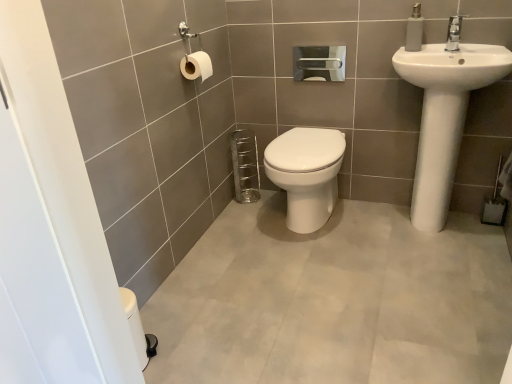
Question: Is white glossy toilet at center positioned beyond the bounds of white matte soap dispenser at upper right?

Choices:
 (A) yes
 (B) no

Answer: (A)

Question: Can you confirm if white glossy toilet at center is bigger than white matte soap dispenser at upper right?

Choices:
 (A) yes
 (B) no

Answer: (A)

Question: From the image's perspective, would you say white glossy toilet at center is positioned over white matte soap dispenser at upper right?

Choices:
 (A) yes
 (B) no

Answer: (B)

Question: Does white glossy toilet at center appear on the left side of white matte soap dispenser at upper right?

Choices:
 (A) yes
 (B) no

Answer: (A)

Question: Is white glossy toilet at center next to white matte soap dispenser at upper right?

Choices:
 (A) no
 (B) yes

Answer: (A)

Question: From a real-world perspective, is white glossy toilet at center physically above white matte soap dispenser at upper right?

Choices:
 (A) no
 (B) yes

Answer: (A)

Question: Could you tell me if white glossy toilet at center is turned towards white glossy toilet at center?

Choices:
 (A) no
 (B) yes

Answer: (B)

Question: Can you confirm if white glossy toilet at center is taller than white glossy toilet at center?

Choices:
 (A) no
 (B) yes

Answer: (B)

Question: Is white glossy toilet at center smaller than white glossy toilet at center?

Choices:
 (A) yes
 (B) no

Answer: (B)

Question: Is white glossy toilet at center located outside white glossy toilet at center?

Choices:
 (A) yes
 (B) no

Answer: (A)

Question: Is white glossy toilet at center wider than white glossy toilet at center?

Choices:
 (A) yes
 (B) no

Answer: (B)

Question: Considering the relative sizes of white glossy toilet at center and white glossy toilet at center in the image provided, is white glossy toilet at center thinner than white glossy toilet at center?

Choices:
 (A) no
 (B) yes

Answer: (B)

Question: From the image's perspective, does white ceramic faucet at upper right appear higher than white matte soap dispenser at upper right?

Choices:
 (A) no
 (B) yes

Answer: (A)